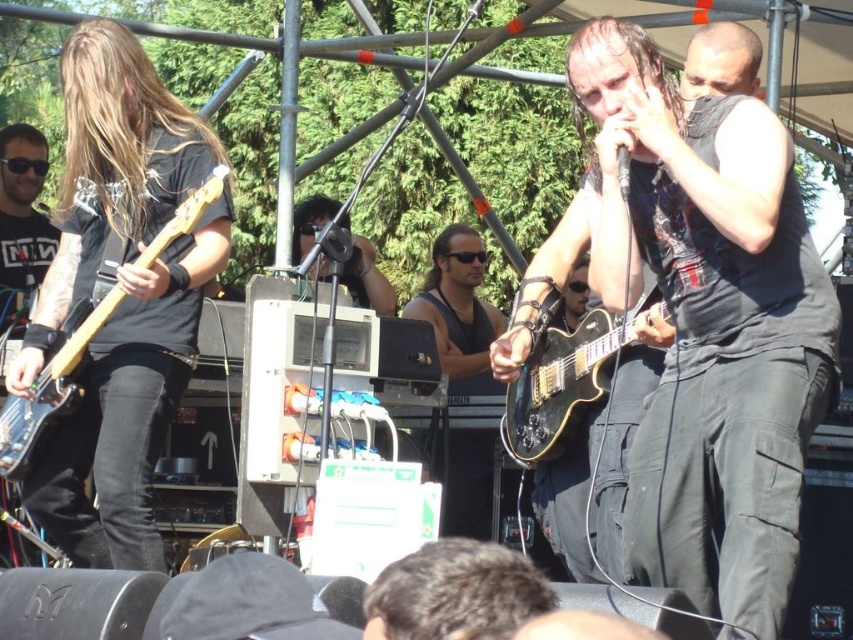
Is black matte vest at right above black leather tank top at center?

Yes.

Can you confirm if black matte vest at right is wider than black leather tank top at center?

Indeed, black matte vest at right has a greater width compared to black leather tank top at center.

Is point (612, 138) positioned after point (465, 243)?

No, (612, 138) is closer to viewer.

Find the location of a particular element. The width and height of the screenshot is (853, 640). black matte vest at right is located at coordinates (x=714, y=336).

Is black matte vest at right smaller than glossy black guitar at center?

Incorrect, black matte vest at right is not smaller in size than glossy black guitar at center.

Image resolution: width=853 pixels, height=640 pixels. What do you see at coordinates (714, 336) in the screenshot?
I see `black matte vest at right` at bounding box center [714, 336].

This screenshot has width=853, height=640. I want to click on black matte vest at right, so click(x=714, y=336).

Based on the photo, can you confirm if black leather tank top at center is positioned to the right of matte wood guitar at left?

Correct, you'll find black leather tank top at center to the right of matte wood guitar at left.

Identify the location of black leather tank top at center. Image resolution: width=853 pixels, height=640 pixels. (457, 301).

You are a GUI agent. You are given a task and a screenshot of the screen. Output one action in this format:
    pyautogui.click(x=<x>, y=<y>)
    Task: Click on the black leather tank top at center
    This screenshot has width=853, height=640.
    Given the screenshot: What is the action you would take?
    pyautogui.click(x=457, y=301)